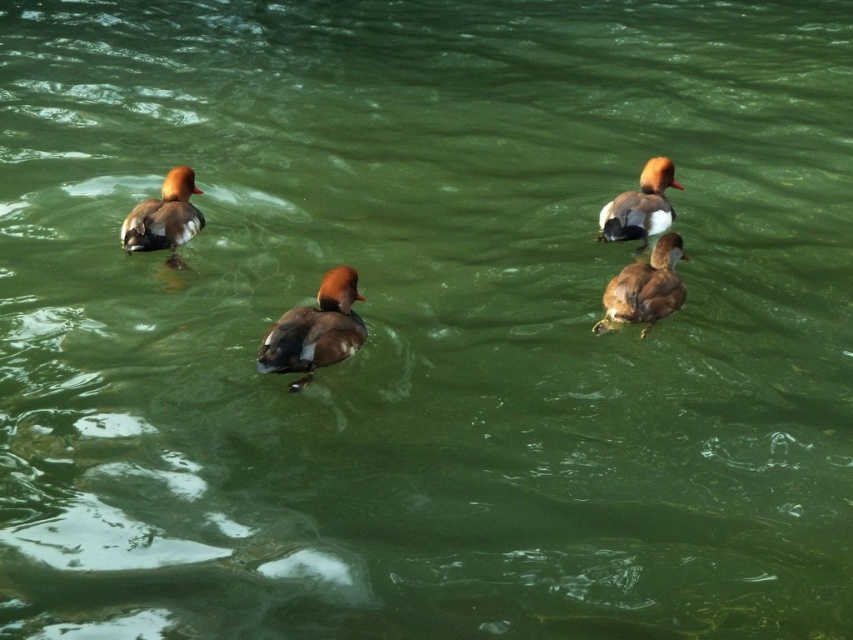
You are observing four ducks swimming in a body of water. You notice two specific points marked as point [281,317] and point [160,225]. Based on their positions, which point is closer to you?

Point [281,317] is in front of point [160,225], so it is closer to you.

You are a photographer trying to capture the brown glossy duck at center in the image. The duck is at point (315, 330). If you want to frame the duck precisely, what coordinates should you aim your camera at?

The brown glossy duck at center is located at point (315, 330), so you should aim your camera at those coordinates to frame it precisely.

Looking at this image, you are a wildlife photographer aiming to capture a closeup of the brown glossy duck at center and the brown matte duck at center. Given that your camera can only focus on one duck at a time, which duck should you focus on to ensure the subject is in sharp focus if you want to highlight its size?

The brown glossy duck at center is smaller than the brown matte duck at center. To highlight its size, you should focus on the brown glossy duck at center since it is smaller and requires attention to detail for its features to be clearly visible.